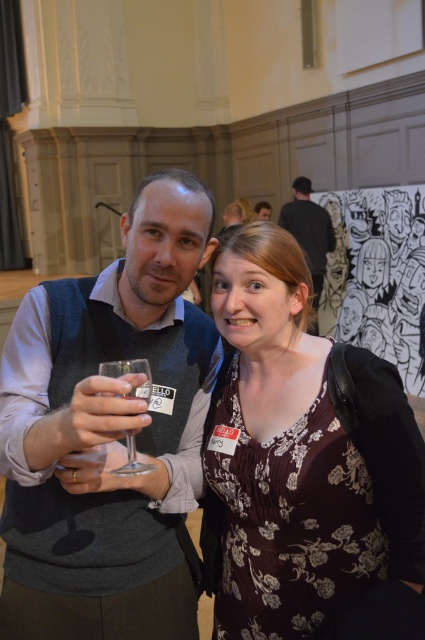
Is point (303, 252) farther from camera compared to point (146, 371)?

Yes, point (303, 252) is farther from viewer.

Which is above, black fabric at upper center or clear glass wine glass at center?

black fabric at upper center is higher up.

Find the location of a particular element. The height and width of the screenshot is (640, 425). black fabric at upper center is located at coordinates (308, 230).

Which of these two, dark gray sweater vest at center or matte floral dress at center, stands shorter?

matte floral dress at center

Who is more forward, (195, 605) or (291, 540)?

Positioned in front is point (291, 540).

Identify the location of dark gray sweater vest at center. (108, 435).

Is matte floral dress at center to the left of black fabric at upper center from the viewer's perspective?

Correct, you'll find matte floral dress at center to the left of black fabric at upper center.

Is point (399, 461) farther from camera compared to point (323, 243)?

No, it is not.

The image size is (425, 640). In order to click on matte floral dress at center in this screenshot , I will do `click(299, 456)`.